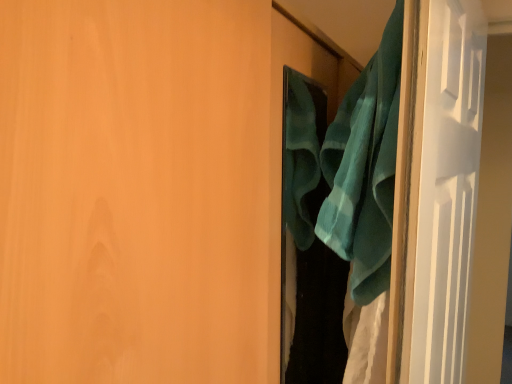
Question: Is teal fabric at right in contact with teal soft towel at right?

Choices:
 (A) yes
 (B) no

Answer: (B)

Question: Considering the relative sizes of teal fabric at right and teal soft towel at right in the image provided, is teal fabric at right smaller than teal soft towel at right?

Choices:
 (A) no
 (B) yes

Answer: (A)

Question: Does teal fabric at right come behind teal soft towel at right?

Choices:
 (A) no
 (B) yes

Answer: (A)

Question: Are teal fabric at right and teal soft towel at right located far from each other?

Choices:
 (A) yes
 (B) no

Answer: (B)

Question: Is teal fabric at right aimed at teal soft towel at right?

Choices:
 (A) no
 (B) yes

Answer: (B)

Question: Does teal fabric at right contain teal soft towel at right?

Choices:
 (A) no
 (B) yes

Answer: (A)

Question: Does teal soft towel at right appear on the right side of teal fabric at right?

Choices:
 (A) no
 (B) yes

Answer: (B)

Question: Is teal soft towel at right positioned with its back to teal fabric at right?

Choices:
 (A) yes
 (B) no

Answer: (A)

Question: Does teal soft towel at right have a lesser height compared to teal fabric at right?

Choices:
 (A) no
 (B) yes

Answer: (B)

Question: Does teal soft towel at right appear on the left side of teal fabric at right?

Choices:
 (A) yes
 (B) no

Answer: (B)

Question: Is teal soft towel at right oriented towards teal fabric at right?

Choices:
 (A) yes
 (B) no

Answer: (B)

Question: Is teal soft towel at right not within teal fabric at right?

Choices:
 (A) no
 (B) yes

Answer: (B)

Question: Would you say teal fabric at right is part of teal fabric at right's contents?

Choices:
 (A) yes
 (B) no

Answer: (B)